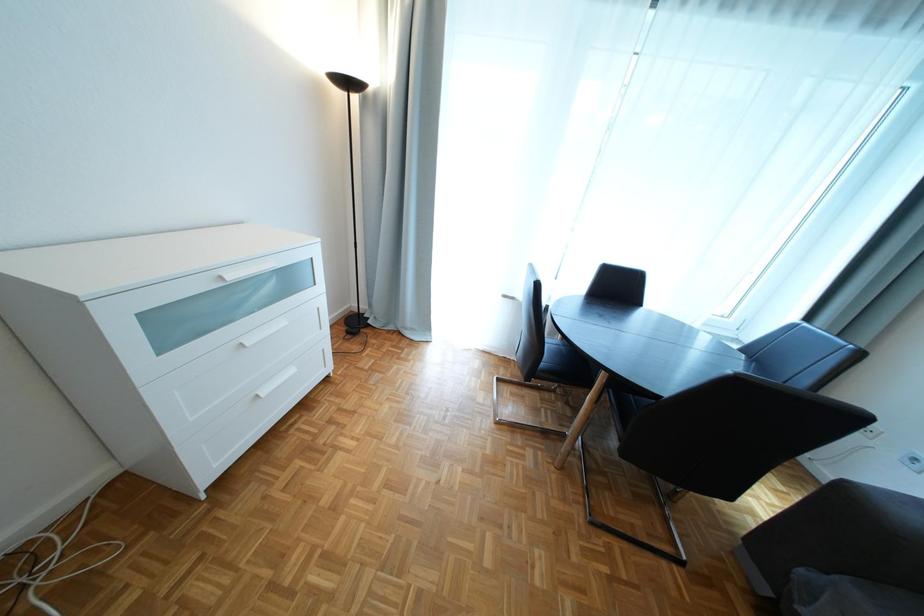
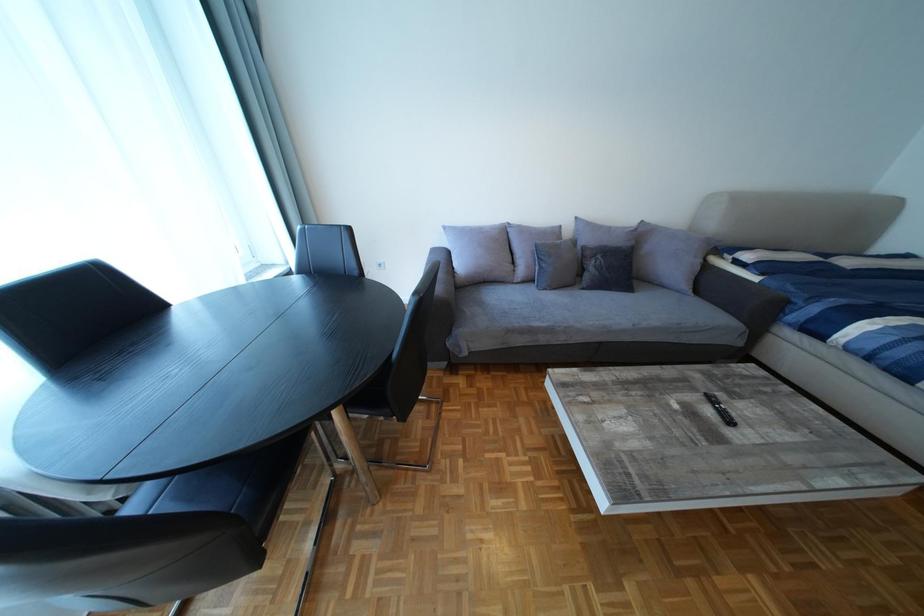
The first image is from the beginning of the video and the second image is from the end. How did the camera likely rotate when shooting the video?

The camera rotated toward right-down.